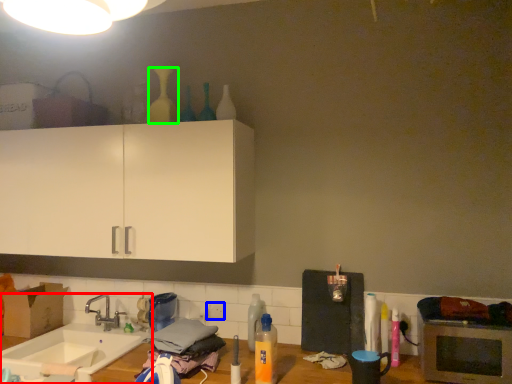
Question: Estimate the real-world distances between objects in this image. Which object is farther from sink (highlighted by a red box), electric outlet (highlighted by a blue box) or bottle (highlighted by a green box)?

Choices:
 (A) electric outlet
 (B) bottle

Answer: (B)